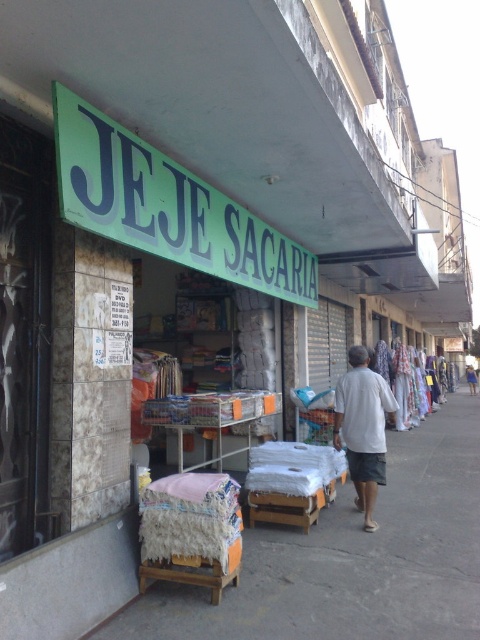
Question: Estimate the real-world distances between objects in this image. Which object is closer to the white fabric at center?

Choices:
 (A) white cotton dress at center
 (B) white cotton shirt at center

Answer: (B)

Question: Which object is farther from the camera taking this photo?

Choices:
 (A) white cotton dress at center
 (B) white fabric at center
 (C) green plastic sign at upper center
 (D) white cotton shirt at center

Answer: (A)

Question: Is green plastic sign at upper center behind white cotton shirt at center?

Choices:
 (A) yes
 (B) no

Answer: (B)

Question: Where is white fabric at center located in relation to white cotton dress at center in the image?

Choices:
 (A) above
 (B) below

Answer: (A)

Question: Is white fabric at center further to the viewer compared to white cotton dress at center?

Choices:
 (A) yes
 (B) no

Answer: (B)

Question: Which point is farther to the camera?

Choices:
 (A) white cotton dress at center
 (B) white fabric at center

Answer: (A)